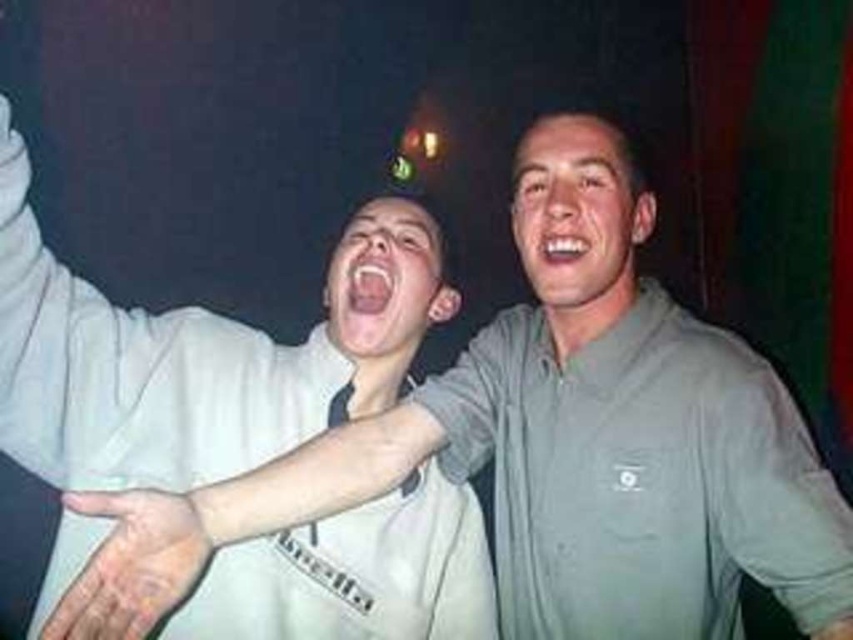
Which of these two, white fabric arm at center or gray cotton arm at right, stands taller?

white fabric arm at center is taller.

Does white fabric arm at center appear on the left side of gray cotton arm at right?

Yes, white fabric arm at center is to the left of gray cotton arm at right.

Is point (416, 580) positioned behind point (705, 406)?

Yes, point (416, 580) is behind point (705, 406).

Identify the location of white fabric arm at center. (207, 388).

Is dry skin at center to the left of white glossy teeth at center from the viewer's perspective?

Yes, dry skin at center is to the left of white glossy teeth at center.

Which is behind, point (167, 588) or point (556, 259)?

The point (556, 259) is more distant.

Identify the location of dry skin at center. pyautogui.click(x=132, y=564).

Does gray cotton arm at right appear on the right side of white glossy teeth at center?

Yes, gray cotton arm at right is to the right of white glossy teeth at center.

Which is behind, point (839, 548) or point (556, 236)?

Point (556, 236)

Locate an element on the screen. The width and height of the screenshot is (853, 640). gray cotton arm at right is located at coordinates (775, 492).

You are a GUI agent. You are given a task and a screenshot of the screen. Output one action in this format:
    pyautogui.click(x=<x>, y=<y>)
    Task: Click on the gray cotton arm at right
    The height and width of the screenshot is (640, 853).
    Given the screenshot: What is the action you would take?
    pyautogui.click(x=775, y=492)